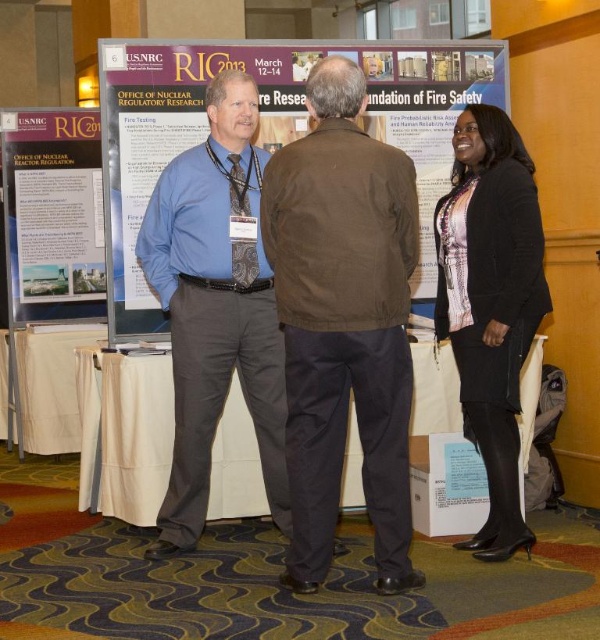
Which is in front, point (250, 132) or point (16, 120)?

Positioned in front is point (250, 132).

Which is behind, point (234, 368) or point (67, 118)?

Positioned behind is point (67, 118).

Identify the location of matte blue shirt at center. (216, 307).

Can you confirm if brown leather jacket at center is positioned to the left of black woolen coat at right?

Indeed, brown leather jacket at center is positioned on the left side of black woolen coat at right.

What do you see at coordinates (343, 323) in the screenshot? The height and width of the screenshot is (640, 600). I see `brown leather jacket at center` at bounding box center [343, 323].

Where is `brown leather jacket at center`? The width and height of the screenshot is (600, 640). brown leather jacket at center is located at coordinates [x=343, y=323].

In the scene shown: Which is below, black woolen coat at right or matte paper poster at left?

black woolen coat at right is lower down.

Which is behind, point (477, 380) or point (103, 314)?

The point (103, 314) is behind.

Find the location of `black woolen coat at right`. black woolen coat at right is located at coordinates (490, 304).